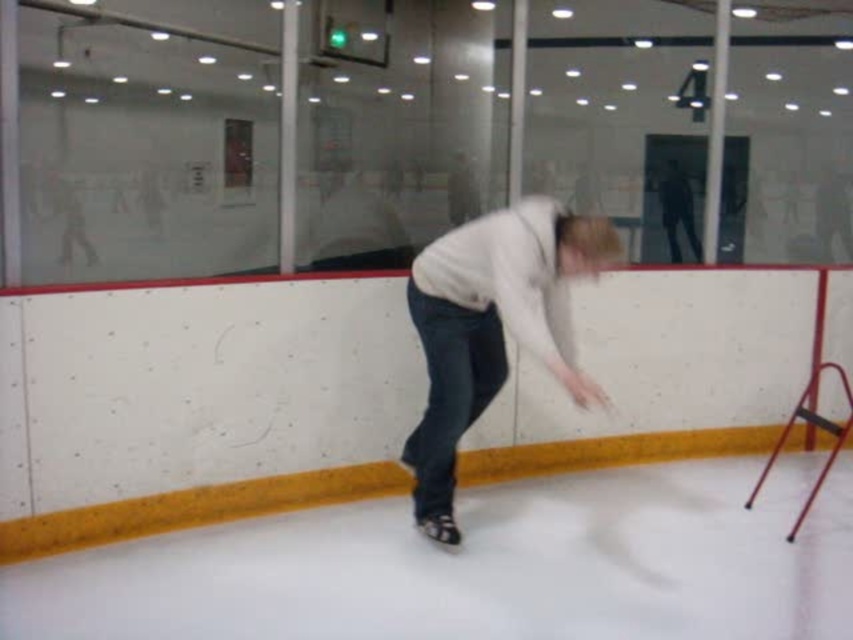
Does white smooth ice at lower center have a smaller size compared to white matte sweater at center?

No.

Between point (79, 636) and point (556, 317), which one is positioned in front?

Positioned in front is point (79, 636).

At what (x,y) coordinates should I click in order to perform the action: click on white smooth ice at lower center. Please return your answer as a coordinate pair (x, y). The width and height of the screenshot is (853, 640). Looking at the image, I should click on (480, 566).